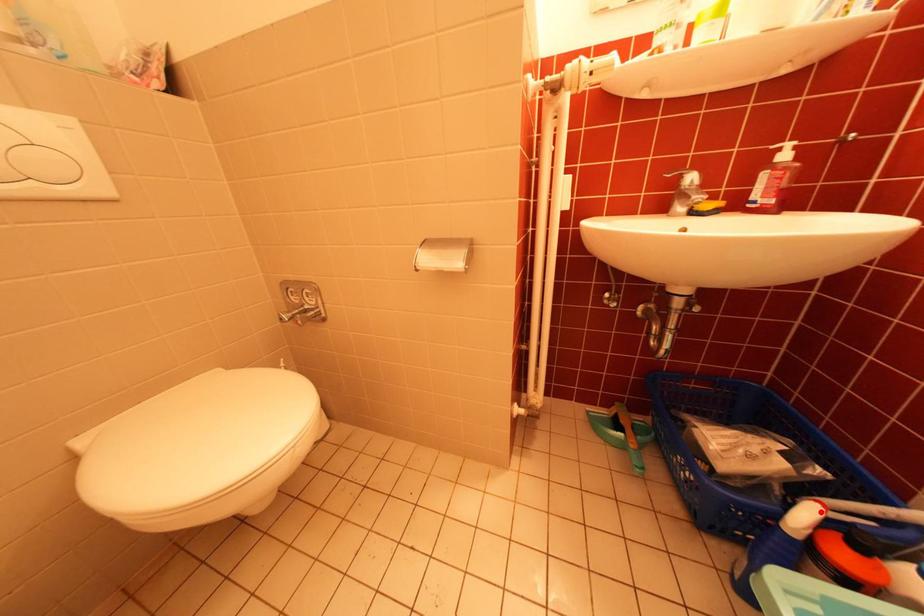
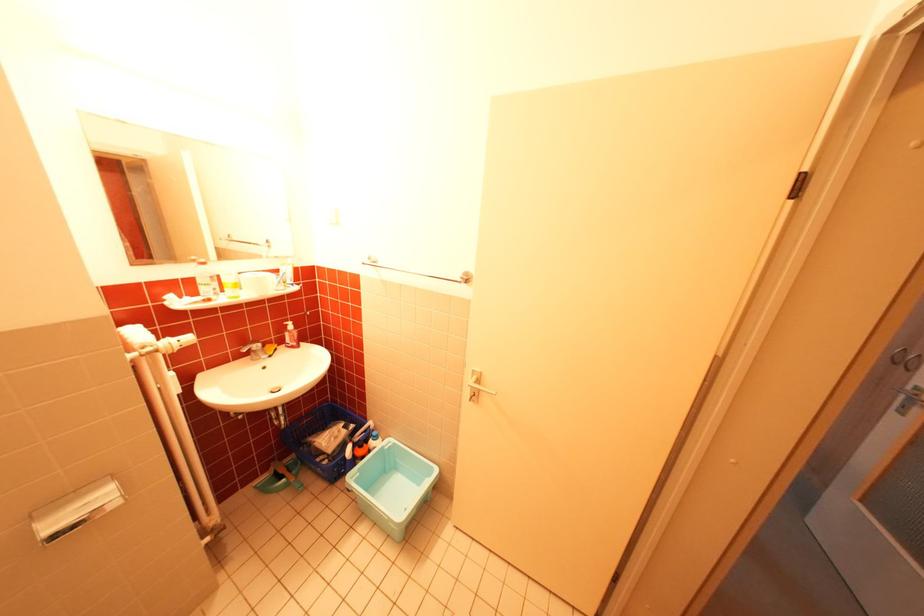
Locate, in the second image, the point that corresponds to the highlighted location in the first image.

(360, 448)